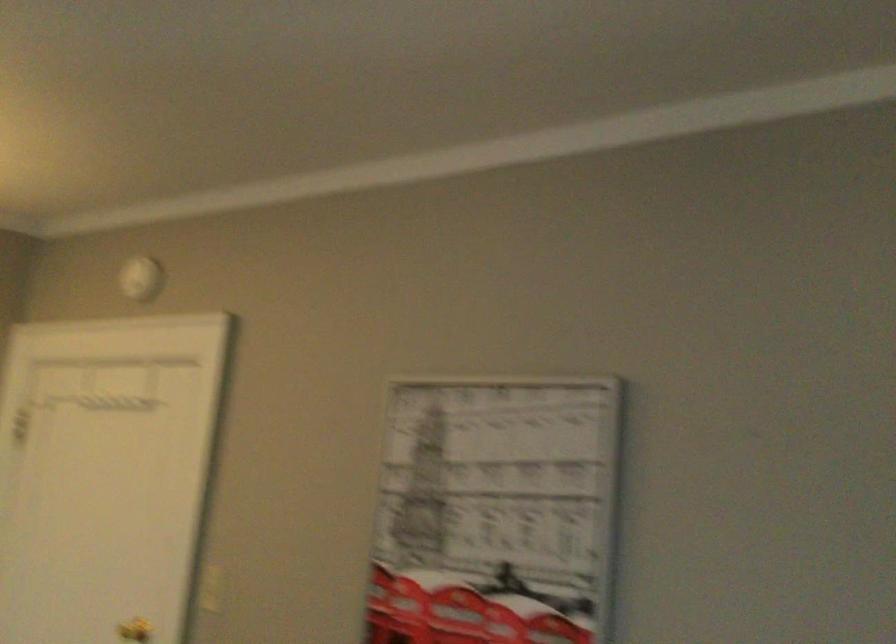
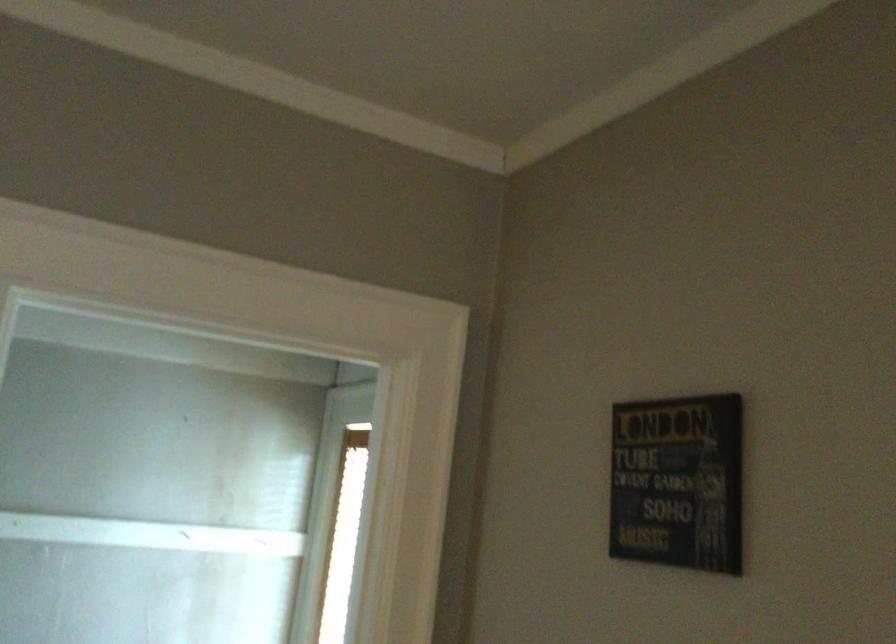
Question: The camera is either moving clockwise (left) or counter-clockwise (right) around the object. The first image is from the beginning of the video and the second image is from the end. Is the camera moving left or right when shooting the video?

Choices:
 (A) Left
 (B) Right

Answer: (A)